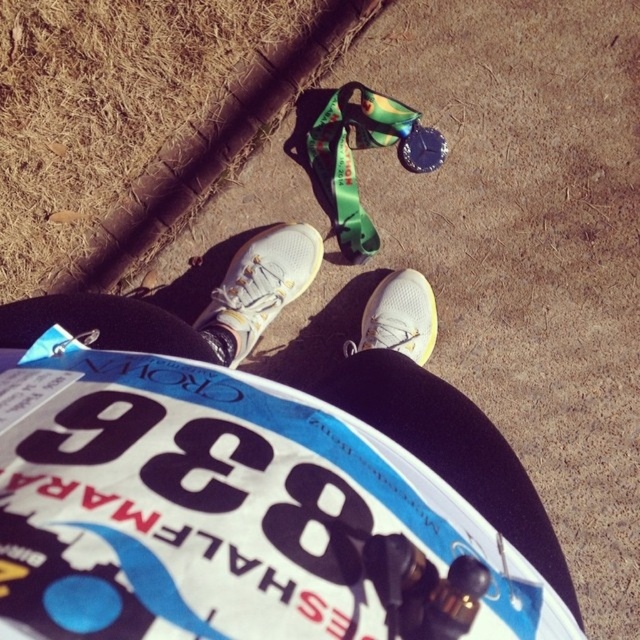
From the picture: You are a race official measuring the distance between the two white shoes on the runner. The official rule states that the shoes must be at least 10 inches apart for proper placement. Based on the image, are the white fabric shoe at center and white mesh shoe at center meeting the requirement?

The distance between the white fabric shoe at center and white mesh shoe at center is 9.51 inches, which is less than the required 10 inches. Therefore, they do not meet the requirement.

You are a race official checking the runner for proper footwear. The rule states that both shoes must be the same size. Looking at the white fabric shoe at center and the white mesh shoe at center, which one is larger?

The white fabric shoe at center is larger in size than the white mesh shoe at center, so the runner is violating the footwear rule.

You are a photographer trying to capture the exact spot where the white fabric shoe at center was placed. According to the coordinates provided, where should you position your camera to align with the shoe?

The white fabric shoe at center was positioned at coordinates point (259, 289), so you should align your camera to that exact point to capture the shoe.